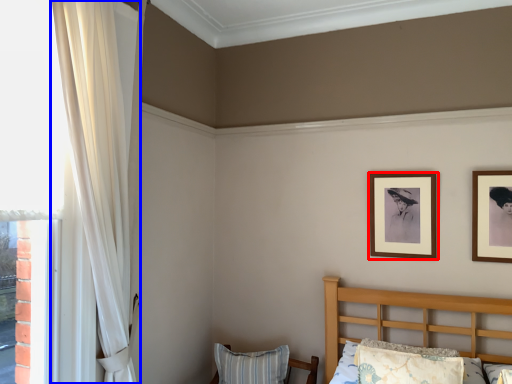
Question: Which point is closer to the camera, picture frame (highlighted by a red box) or curtain (highlighted by a blue box)?

Choices:
 (A) picture frame
 (B) curtain

Answer: (B)